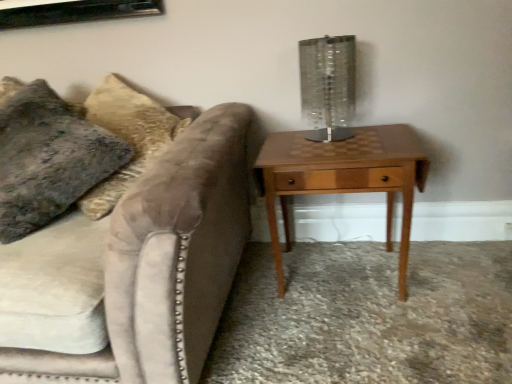
Locate an element on the screen. This screenshot has height=384, width=512. free region on the left part of woodenmaterial/texturenightstand at right is located at coordinates (248, 302).